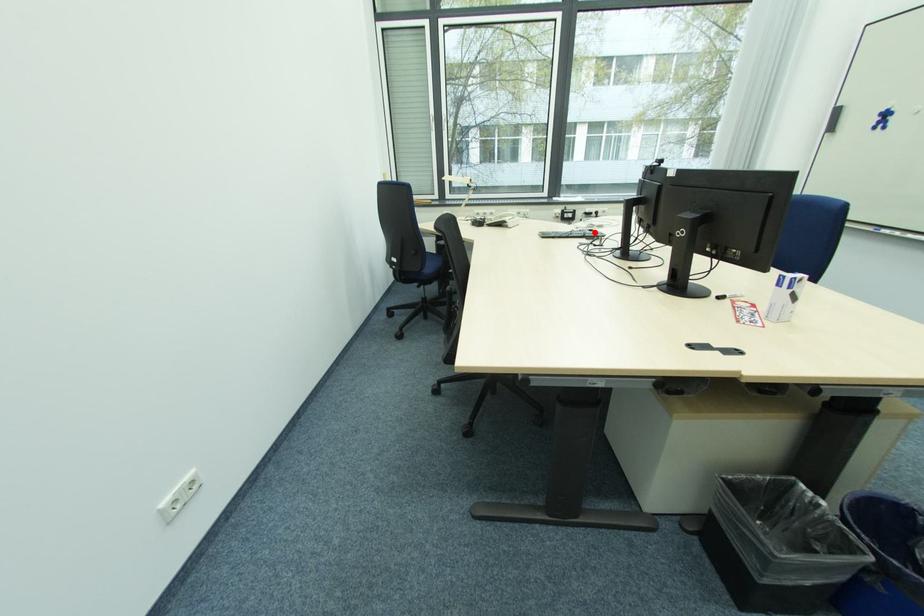
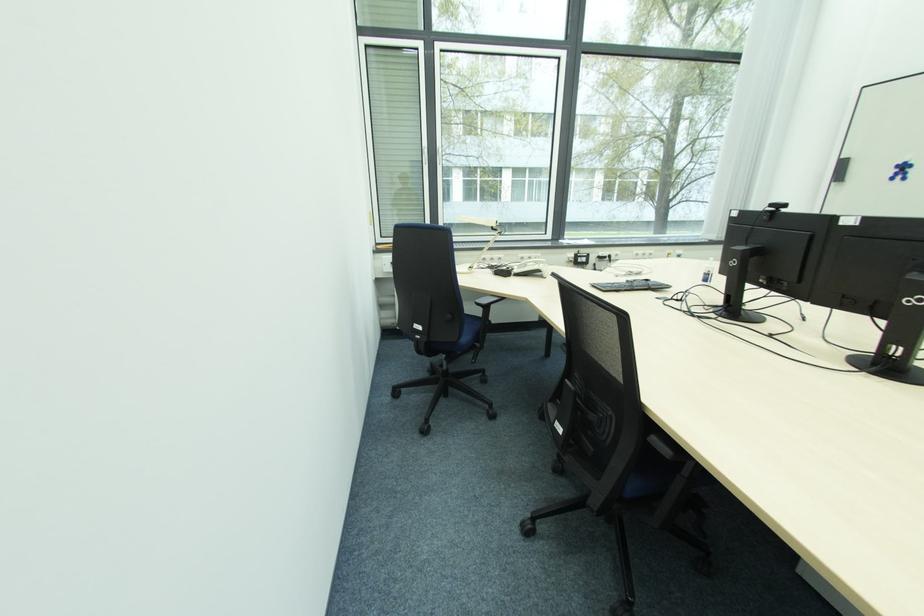
Where in the second image is the point corresponding to the highlighted location from the first image?

(650, 283)